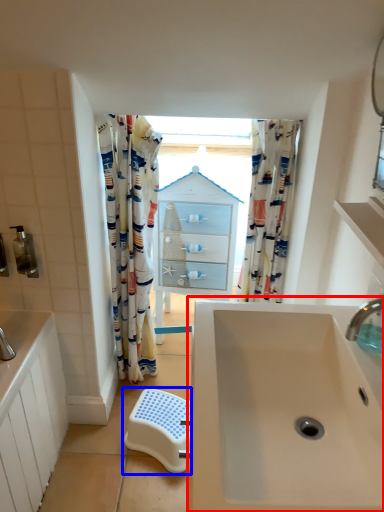
Question: Which of the following is the closest to the observer, sink (highlighted by a red box) or step stool (highlighted by a blue box)?

Choices:
 (A) sink
 (B) step stool

Answer: (A)